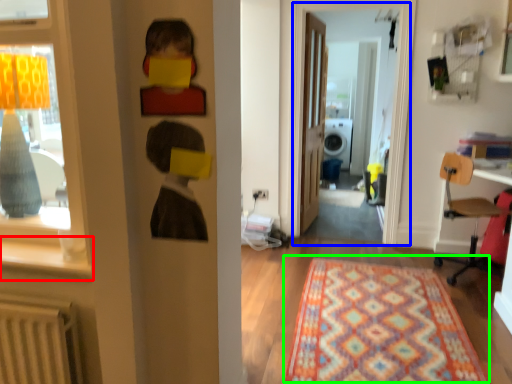
Question: Which object is the closest to the window sill (highlighted by a red box)? Choose among these: window screen (highlighted by a blue box) or mat (highlighted by a green box).

Choices:
 (A) window screen
 (B) mat

Answer: (B)